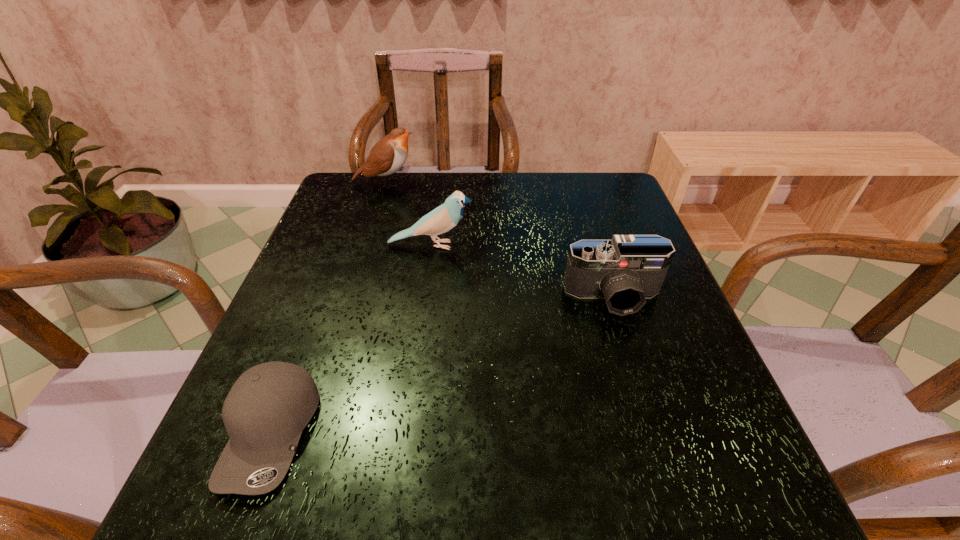
The height and width of the screenshot is (540, 960). Identify the location of vacant space at the far left corner of the desktop. (332, 210).

The image size is (960, 540). In the image, there is a desktop. In order to click on vacant space at the far right corner in this screenshot , I will do `click(569, 182)`.

At what (x,y) coordinates should I click in order to perform the action: click on free spot between the baseball cap and the rightmost object. Please return your answer as a coordinate pair (x, y). Image resolution: width=960 pixels, height=540 pixels. Looking at the image, I should click on (443, 364).

Image resolution: width=960 pixels, height=540 pixels. I want to click on blank region between the baseball cap and the second nearest object, so click(x=443, y=364).

Where is `empty location between the nearer bird and the farthest object`? The width and height of the screenshot is (960, 540). empty location between the nearer bird and the farthest object is located at coordinates (409, 214).

The height and width of the screenshot is (540, 960). In order to click on vacant area between the nearer bird and the nearest object in this screenshot , I will do `click(351, 339)`.

The image size is (960, 540). Identify the location of vacant space that is in between the farthest object and the shortest object. (328, 307).

This screenshot has height=540, width=960. Identify the location of vacant space that is in between the nearer bird and the shortest object. (351, 339).

At what (x,y) coordinates should I click in order to perform the action: click on vacant space that's between the shortest object and the farther bird. Please return your answer as a coordinate pair (x, y). Looking at the image, I should click on (328, 307).

Where is `vacant point located between the farther bird and the nearest object`? vacant point located between the farther bird and the nearest object is located at coordinates (328, 307).